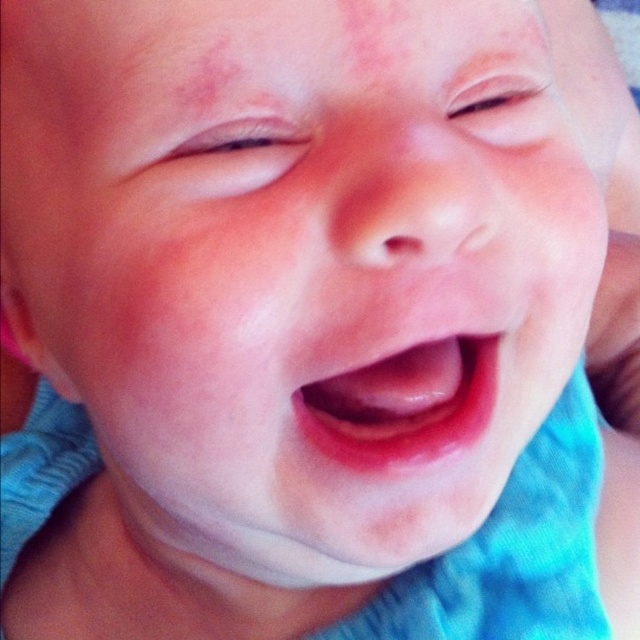
Based on the scene, which object is bigger between the pink glossy lips at center and the pink smooth skin at upper center?

The pink glossy lips at center is larger in size than the pink smooth skin at upper center.

Based on the scene description, which object is larger in size between the pink smooth skin at upper center and the pink smooth freckle at upper left?

The pink smooth skin at upper center is bigger than the pink smooth freckle at upper left according to the description.